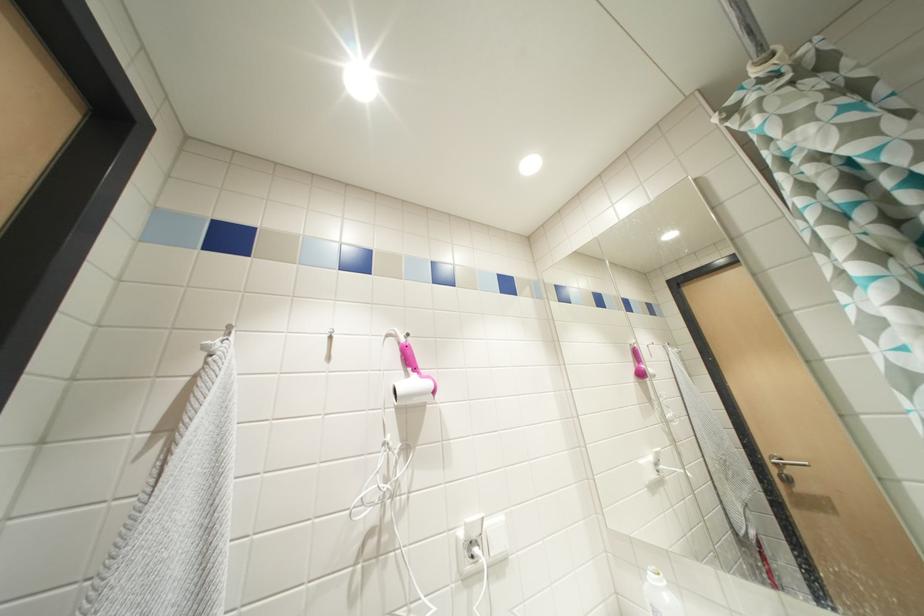
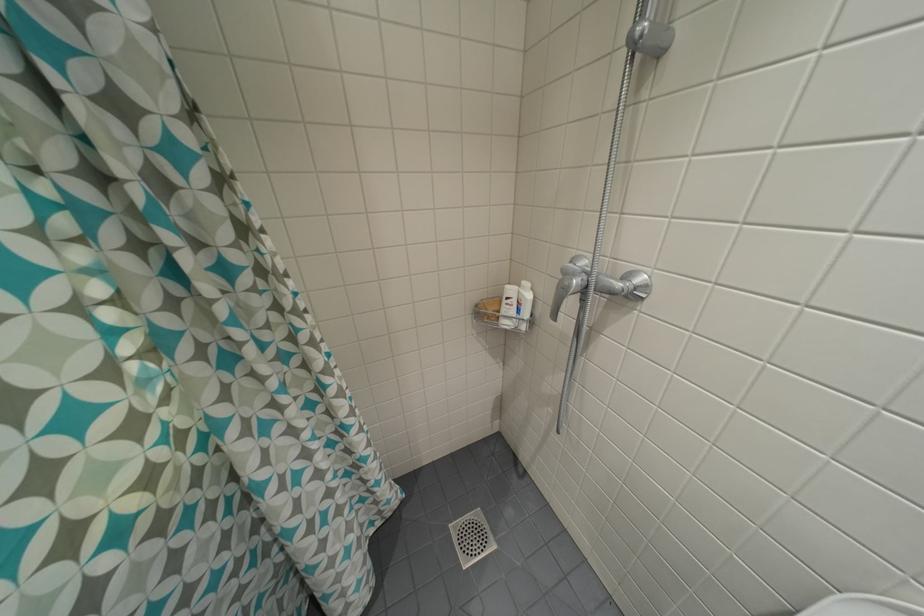
First-person continuous shooting, in which direction is the camera rotating?

The rotation direction of the camera is right-down.